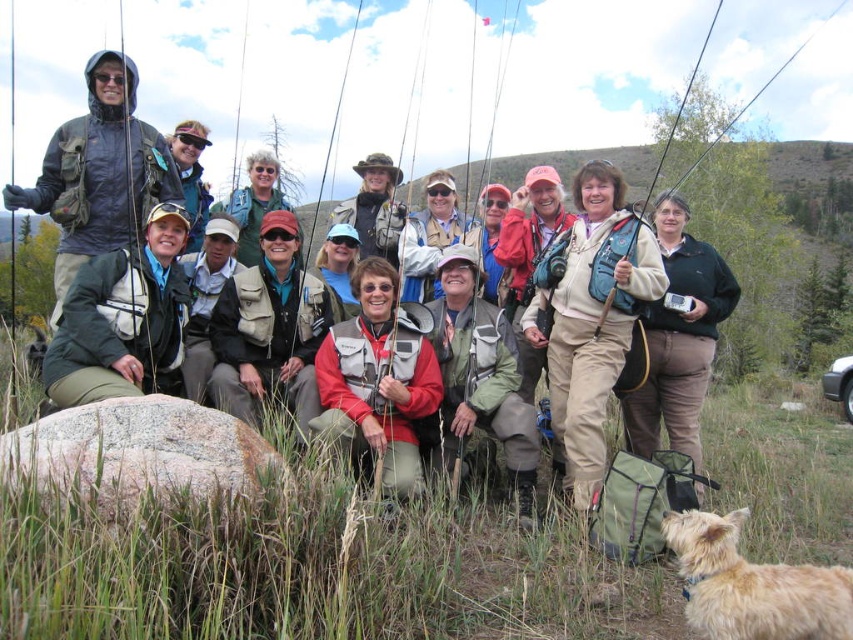
Is matte black jacket at upper left positioned behind dark green jacket at center?

That is False.

This screenshot has height=640, width=853. What do you see at coordinates (119, 180) in the screenshot?
I see `matte black jacket at upper left` at bounding box center [119, 180].

Find the location of `matte black jacket at upper left`. matte black jacket at upper left is located at coordinates (119, 180).

Find the location of a particular element. The width and height of the screenshot is (853, 640). matte black jacket at upper left is located at coordinates (119, 180).

Which is more to the right, matte red jacket at center or dark green jacket at center?

dark green jacket at center is more to the right.

Between matte red jacket at center and dark green jacket at center, which one has less height?

matte red jacket at center is shorter.

Between point (439, 397) and point (699, 280), which one is positioned behind?

Positioned behind is point (699, 280).

The height and width of the screenshot is (640, 853). Find the location of `matte red jacket at center`. matte red jacket at center is located at coordinates (376, 381).

Is green fabric jacket at lower left wider than light brown fur at lower right?

Yes.

Who is more distant from viewer, [77,369] or [763,596]?

Positioned behind is point [77,369].

Where is `green fabric jacket at lower left`? This screenshot has width=853, height=640. green fabric jacket at lower left is located at coordinates [123, 320].